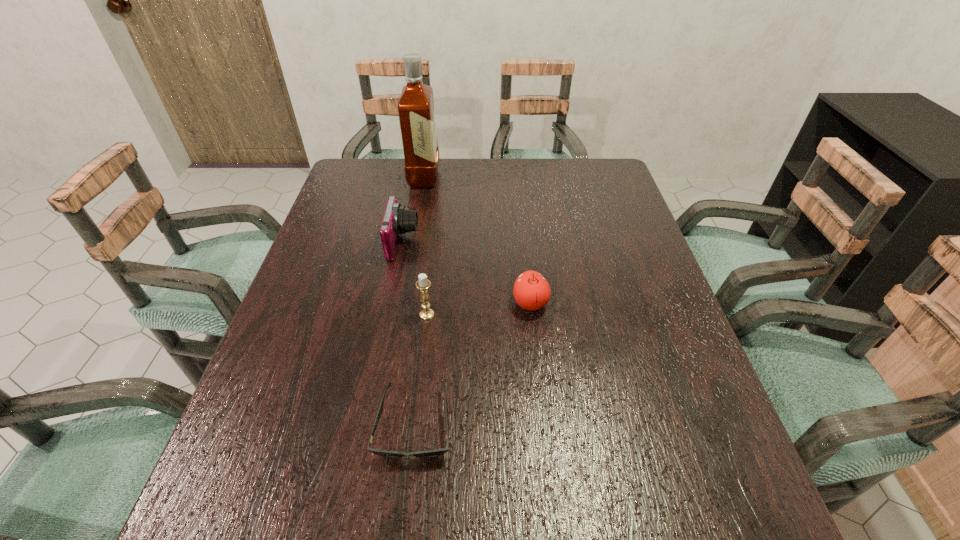
The image size is (960, 540). In order to click on the farthest object in this screenshot , I will do `click(416, 112)`.

Locate an element on the screen. This screenshot has height=540, width=960. liquor is located at coordinates (416, 112).

You are a GUI agent. You are given a task and a screenshot of the screen. Output one action in this format:
    pyautogui.click(x=<x>, y=<y>)
    Task: Click on the candle holder
    This screenshot has height=540, width=960.
    Given the screenshot: What is the action you would take?
    pyautogui.click(x=422, y=284)

Image resolution: width=960 pixels, height=540 pixels. In order to click on the second farthest object in this screenshot , I will do `click(397, 220)`.

Locate an element on the screen. The image size is (960, 540). the rightmost object is located at coordinates (531, 290).

Find the location of a particular element. The image size is (960, 540). the nearest object is located at coordinates click(x=436, y=452).

In order to click on sunglasses in this screenshot , I will do `click(436, 452)`.

Identify the location of vacant space located on the front label of the liquor. The height and width of the screenshot is (540, 960). (487, 178).

Locate an element on the screen. vacant space located 0.200m on the right of the second tallest object is located at coordinates (519, 314).

I want to click on free space located 0.330m on the front-facing side of the camera, so click(537, 243).